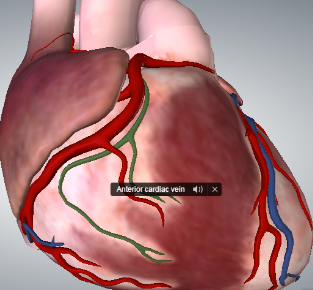
You are a GUI agent. You are given a task and a screenshot of the screen. Output one action in this format:
    pyautogui.click(x=<x>, y=<y>)
    Task: Click on the speaker button
    The width and height of the screenshot is (313, 290).
    Given the screenshot: What is the action you would take?
    pyautogui.click(x=197, y=189)